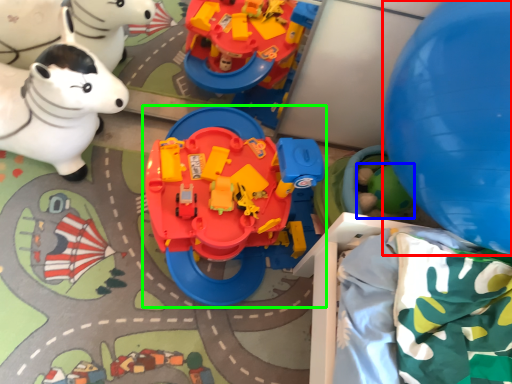
Question: Which object is positioned closest to balloon (highlighted by a red box)? Select from toy (highlighted by a blue box) and toy (highlighted by a green box).

Choices:
 (A) toy
 (B) toy

Answer: (B)